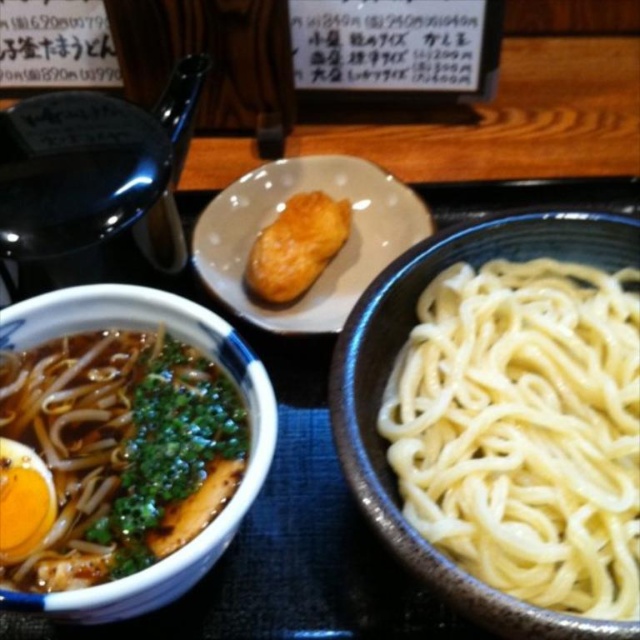
Question: Which object appears farthest from the camera in this image?

Choices:
 (A) matte ceramic plate at center
 (B) matte ceramic bowl at left
 (C) white matte noodles at right

Answer: (A)

Question: Where is matte ceramic plate at center located in relation to golden crispy chicken at center in the image?

Choices:
 (A) left
 (B) right

Answer: (B)

Question: Which point is closer to the camera taking this photo?

Choices:
 (A) (296, 289)
 (B) (577, 476)
 (C) (48, 298)

Answer: (B)

Question: Which object is closer to the camera taking this photo?

Choices:
 (A) matte ceramic plate at center
 (B) golden crispy chicken at center

Answer: (A)

Question: Does white matte noodles at right lie in front of matte ceramic bowl at left?

Choices:
 (A) no
 (B) yes

Answer: (A)

Question: Does white matte noodles at right appear over matte ceramic plate at center?

Choices:
 (A) no
 (B) yes

Answer: (A)